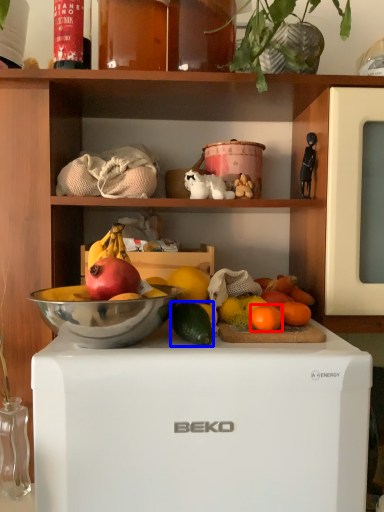
Question: Which object is further to the camera taking this photo, grapefruit (highlighted by a red box) or avocado (highlighted by a blue box)?

Choices:
 (A) grapefruit
 (B) avocado

Answer: (A)